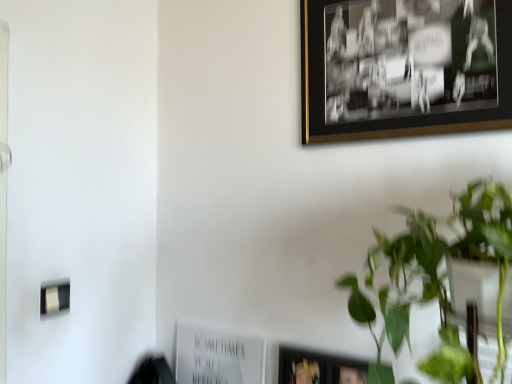
Question: From a real-world perspective, is green leafy plant at upper right physically located above or below black/golden frame at upper right, the 1th picture frame viewed from the right?

Choices:
 (A) above
 (B) below

Answer: (B)

Question: Relative to black/golden frame at upper right, marked as the 1th picture frame in a front-to-back arrangement, is green leafy plant at upper right in front or behind?

Choices:
 (A) front
 (B) behind

Answer: (A)

Question: Estimate the real-world distances between objects in this image. Which object is closer to the green leafy plant at upper right?

Choices:
 (A) black/golden frame at upper right, which is the second picture frame from bottom to top
 (B) white paper at lower center, the second picture frame when ordered from front to back

Answer: (A)

Question: Estimate the real-world distances between objects in this image. Which object is farther from the white paper at lower center, which ranks as the first picture frame in back-to-front order?

Choices:
 (A) black/golden frame at upper right, which is the 1th picture frame in top-to-bottom order
 (B) green leafy plant at upper right

Answer: (A)